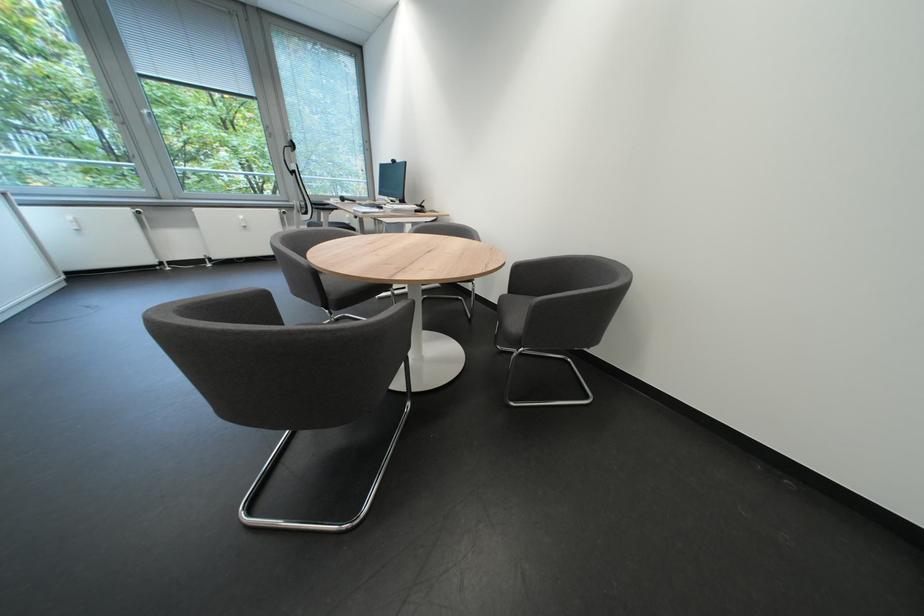
The height and width of the screenshot is (616, 924). What do you see at coordinates (514, 307) in the screenshot? I see `the grey chair sitting surface` at bounding box center [514, 307].